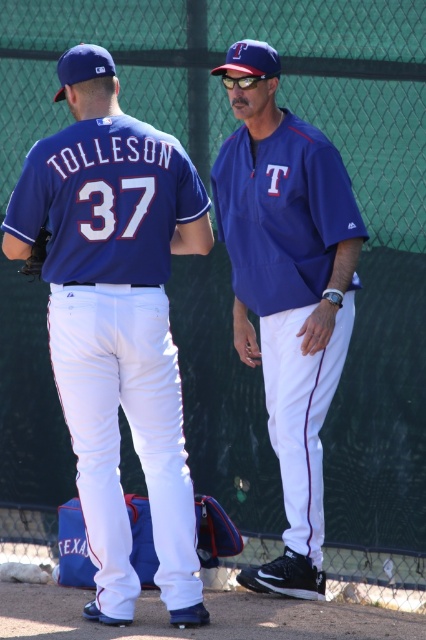
You are a photographer standing at the center of the baseball field. You want to take a photo of the two points marked in the image. Which point, point (310, 244) or point (40, 252), is closer to your camera?

Point (40, 252) is closer to the camera because it is less further than point (310, 244).

You are standing at the point marked as point (x=184, y=508) on the baseball field and want to walk towards the fence in the background. How far will you have to walk to reach the fence?

The distance between point (x=184, y=508) and the viewer is 21.78 feet, so you will have to walk 21.78 feet to reach the fence in the background.